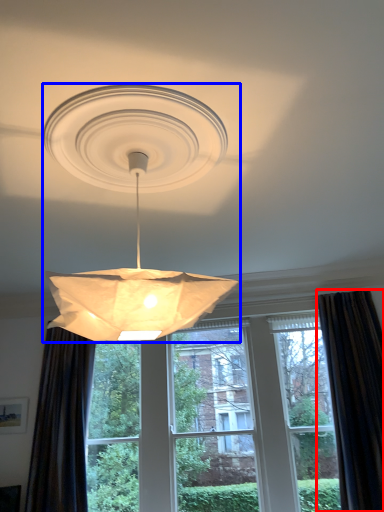
Question: Which object is closer to the camera taking this photo, curtain (highlighted by a red box) or lamp (highlighted by a blue box)?

Choices:
 (A) curtain
 (B) lamp

Answer: (B)